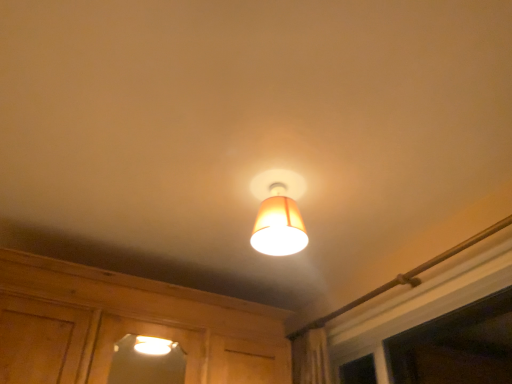
Question: Is white plastic window at upper right inside matte orange fabric lampshade at center?

Choices:
 (A) no
 (B) yes

Answer: (A)

Question: From the image's perspective, is matte orange fabric lampshade at center on top of white plastic window at upper right?

Choices:
 (A) yes
 (B) no

Answer: (A)

Question: Is matte orange fabric lampshade at center thinner than white plastic window at upper right?

Choices:
 (A) yes
 (B) no

Answer: (B)

Question: Does matte orange fabric lampshade at center appear on the left side of white plastic window at upper right?

Choices:
 (A) no
 (B) yes

Answer: (B)

Question: Is there a large distance between matte orange fabric lampshade at center and white plastic window at upper right?

Choices:
 (A) no
 (B) yes

Answer: (B)

Question: Can you confirm if matte orange fabric lampshade at center is wider than white plastic window at upper right?

Choices:
 (A) yes
 (B) no

Answer: (A)

Question: Does white plastic window at upper right appear on the right side of matte orange fabric lampshade at center?

Choices:
 (A) no
 (B) yes

Answer: (B)

Question: Is white plastic window at upper right not close to matte orange fabric lampshade at center?

Choices:
 (A) no
 (B) yes

Answer: (B)

Question: Does white plastic window at upper right come behind matte orange fabric lampshade at center?

Choices:
 (A) no
 (B) yes

Answer: (A)

Question: Considering the relative sizes of white plastic window at upper right and matte orange fabric lampshade at center in the image provided, is white plastic window at upper right wider than matte orange fabric lampshade at center?

Choices:
 (A) yes
 (B) no

Answer: (B)

Question: From a real-world perspective, is white plastic window at upper right positioned under matte orange fabric lampshade at center based on gravity?

Choices:
 (A) no
 (B) yes

Answer: (B)

Question: Is white plastic window at upper right located outside matte orange fabric lampshade at center?

Choices:
 (A) no
 (B) yes

Answer: (B)

Question: Is white plastic window at upper right situated inside matte orange fabric lampshade at center or outside?

Choices:
 (A) outside
 (B) inside

Answer: (A)